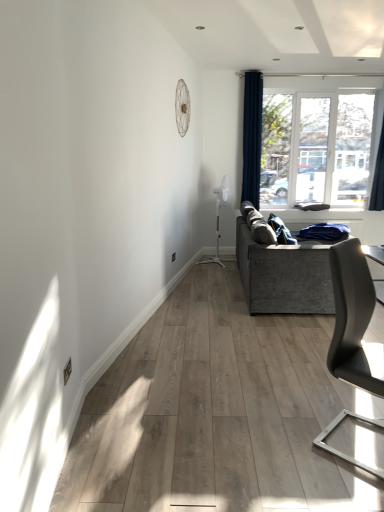
What do you see at coordinates (354, 320) in the screenshot? Image resolution: width=384 pixels, height=512 pixels. I see `matte gray chair at right` at bounding box center [354, 320].

The image size is (384, 512). I want to click on textured gray couch at right, so click(x=284, y=275).

Where is `transparent glass window at upper right`? transparent glass window at upper right is located at coordinates tap(325, 144).

What's the angular difference between transparent glass window at upper right and textured gray couch at right's facing directions?

88.8 degrees.

Is transparent glass window at upper right far away from textured gray couch at right?

Absolutely, transparent glass window at upper right is distant from textured gray couch at right.

Which is in front, point (303, 124) or point (302, 308)?

The point (302, 308) is closer.

This screenshot has width=384, height=512. I want to click on studio couch in front of the transparent glass window at upper right, so click(284, 275).

From the image's perspective, is dark blue fabric curtain at upper right, arranged as the first curtain when viewed from the left, on top of dark blue fabric curtain at upper right, placed as the first curtain when sorted from right to left?

Correct, dark blue fabric curtain at upper right, arranged as the first curtain when viewed from the left, appears higher than dark blue fabric curtain at upper right, placed as the first curtain when sorted from right to left, in the image.

Find the location of `curtain above the dark blue fabric curtain at upper right, which ranks as the second curtain in right-to-left order (from a real-world perspective)`. curtain above the dark blue fabric curtain at upper right, which ranks as the second curtain in right-to-left order (from a real-world perspective) is located at coordinates (378, 177).

In the scene shown: Considering the relative sizes of dark blue fabric curtain at upper right, arranged as the first curtain when viewed from the left, and dark blue fabric curtain at upper right, placed as the first curtain when sorted from right to left, in the image provided, is dark blue fabric curtain at upper right, arranged as the first curtain when viewed from the left, smaller than dark blue fabric curtain at upper right, placed as the first curtain when sorted from right to left,?

Incorrect, dark blue fabric curtain at upper right, arranged as the first curtain when viewed from the left, is not smaller in size than dark blue fabric curtain at upper right, placed as the first curtain when sorted from right to left.

From a real-world perspective, relative to dark blue fabric curtain at upper right, arranged as the first curtain when viewed from the left, is matte gray chair at right vertically above or below?

From a real-world perspective, matte gray chair at right is physically below dark blue fabric curtain at upper right, arranged as the first curtain when viewed from the left.

Between matte gray chair at right and dark blue fabric curtain at upper right, arranged as the first curtain when viewed from the left, which one appears on the left side from the viewer's perspective?

dark blue fabric curtain at upper right, arranged as the first curtain when viewed from the left.

Does point (362, 324) come farther from viewer compared to point (251, 122)?

That is False.

Is textured gray couch at right taller than dark blue fabric curtain at upper right, placed as the first curtain when sorted from right to left?

No.

Based on the photo, does textured gray couch at right turn towards dark blue fabric curtain at upper right, which is counted as the 2th curtain, starting from the left?

No.

Consider the image. Does textured gray couch at right appear on the right side of dark blue fabric curtain at upper right, which is counted as the 2th curtain, starting from the left?

Incorrect, textured gray couch at right is not on the right side of dark blue fabric curtain at upper right, which is counted as the 2th curtain, starting from the left.

Between textured gray couch at right and dark blue fabric curtain at upper right, placed as the first curtain when sorted from right to left, which one has smaller width?

dark blue fabric curtain at upper right, placed as the first curtain when sorted from right to left.

In terms of height, does matte gray chair at right look taller or shorter compared to textured gray couch at right?

Considering their sizes, matte gray chair at right has more height than textured gray couch at right.

Can textured gray couch at right be found inside matte gray chair at right?

No, textured gray couch at right is located outside of matte gray chair at right.

Which of these two, matte gray chair at right or textured gray couch at right, is smaller?

matte gray chair at right is smaller.

Which is behind, matte gray chair at right or textured gray couch at right?

textured gray couch at right is behind.

Is dark blue fabric curtain at upper right, placed as the first curtain when sorted from right to left, facing away from textured gray couch at right?

No.

From a real-world perspective, which is physically above, dark blue fabric curtain at upper right, placed as the first curtain when sorted from right to left, or textured gray couch at right?

dark blue fabric curtain at upper right, placed as the first curtain when sorted from right to left.

Which object is wider, dark blue fabric curtain at upper right, placed as the first curtain when sorted from right to left, or matte gray chair at right?

Wider between the two is matte gray chair at right.

From the image's perspective, does dark blue fabric curtain at upper right, placed as the first curtain when sorted from right to left, appear higher than matte gray chair at right?

Correct, dark blue fabric curtain at upper right, placed as the first curtain when sorted from right to left, appears higher than matte gray chair at right in the image.

Are dark blue fabric curtain at upper right, placed as the first curtain when sorted from right to left, and matte gray chair at right making contact?

No, dark blue fabric curtain at upper right, placed as the first curtain when sorted from right to left, is not next to matte gray chair at right.

Considering the sizes of objects dark blue fabric curtain at upper right, placed as the first curtain when sorted from right to left, and matte gray chair at right in the image provided, who is bigger, dark blue fabric curtain at upper right, placed as the first curtain when sorted from right to left, or matte gray chair at right?

matte gray chair at right is bigger.

Find the location of a particular element. window above the textured gray couch at right (from a real-world perspective) is located at coordinates (325, 144).

This screenshot has width=384, height=512. I want to click on curtain that appears in front of the dark blue fabric curtain at upper right, arranged as the first curtain when viewed from the left, so click(378, 177).

Looking at the image, which one is located further to dark blue fabric curtain at upper right, arranged as the first curtain when viewed from the left, textured gray couch at right or transparent glass window at upper right?

textured gray couch at right is positioned further to the anchor dark blue fabric curtain at upper right, arranged as the first curtain when viewed from the left.

Looking at the image, which one is located further to transparent glass window at upper right, matte gray chair at right or textured gray couch at right?

matte gray chair at right is positioned further to the anchor transparent glass window at upper right.

Considering their positions, is dark blue fabric curtain at upper right, placed as the first curtain when sorted from right to left, positioned further to textured gray couch at right than transparent glass window at upper right?

dark blue fabric curtain at upper right, placed as the first curtain when sorted from right to left.

When comparing their distances from dark blue fabric curtain at upper right, placed as the first curtain when sorted from right to left, does dark blue fabric curtain at upper right, which ranks as the second curtain in right-to-left order, or matte gray chair at right seem closer?

Based on the image, dark blue fabric curtain at upper right, which ranks as the second curtain in right-to-left order, appears to be nearer to dark blue fabric curtain at upper right, placed as the first curtain when sorted from right to left.

Which object lies further to the anchor point dark blue fabric curtain at upper right, which is counted as the 2th curtain, starting from the left, textured gray couch at right or dark blue fabric curtain at upper right, which ranks as the second curtain in right-to-left order?

textured gray couch at right is further to dark blue fabric curtain at upper right, which is counted as the 2th curtain, starting from the left.

Which object lies nearer to the anchor point dark blue fabric curtain at upper right, placed as the first curtain when sorted from right to left, matte gray chair at right or textured gray couch at right?

textured gray couch at right.

Estimate the real-world distances between objects in this image. Which object is closer to transparent glass window at upper right, textured gray couch at right or matte gray chair at right?

textured gray couch at right lies closer to transparent glass window at upper right than the other object.

When comparing their distances from matte gray chair at right, does transparent glass window at upper right or textured gray couch at right seem closer?

Among the two, textured gray couch at right is located nearer to matte gray chair at right.

Where is `window between dark blue fabric curtain at upper right, which ranks as the second curtain in right-to-left order, and dark blue fabric curtain at upper right, placed as the first curtain when sorted from right to left, from left to right`? The image size is (384, 512). window between dark blue fabric curtain at upper right, which ranks as the second curtain in right-to-left order, and dark blue fabric curtain at upper right, placed as the first curtain when sorted from right to left, from left to right is located at coordinates (325, 144).

Find the location of `studio couch between matte gray chair at right and dark blue fabric curtain at upper right, which ranks as the second curtain in right-to-left order, from front to back`. studio couch between matte gray chair at right and dark blue fabric curtain at upper right, which ranks as the second curtain in right-to-left order, from front to back is located at coordinates (284, 275).

Identify the location of curtain between textured gray couch at right and dark blue fabric curtain at upper right, arranged as the first curtain when viewed from the left, along the z-axis. Image resolution: width=384 pixels, height=512 pixels. (378, 177).

You are a GUI agent. You are given a task and a screenshot of the screen. Output one action in this format:
    pyautogui.click(x=<x>, y=<y>)
    Task: Click on the studio couch located between matte gray chair at right and dark blue fabric curtain at upper right, which is counted as the 2th curtain, starting from the left, in the depth direction
    The height and width of the screenshot is (512, 384).
    Given the screenshot: What is the action you would take?
    pyautogui.click(x=284, y=275)